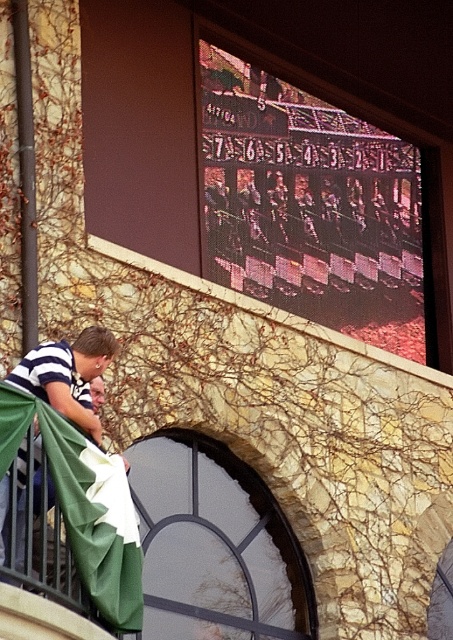
Question: Which point is farther from the camera taking this photo?

Choices:
 (A) (133, 536)
 (B) (92, 426)

Answer: (B)

Question: Which of the following is the farthest from the observer?

Choices:
 (A) striped cotton shirt at lower left
 (B) green fabric flag at lower left

Answer: (B)

Question: Does striped cotton shirt at lower left appear on the right side of green fabric flag at lower left?

Choices:
 (A) no
 (B) yes

Answer: (A)

Question: Is striped cotton shirt at lower left bigger than green fabric flag at lower left?

Choices:
 (A) no
 (B) yes

Answer: (B)

Question: Does striped cotton shirt at lower left have a greater width compared to green fabric flag at lower left?

Choices:
 (A) yes
 (B) no

Answer: (A)